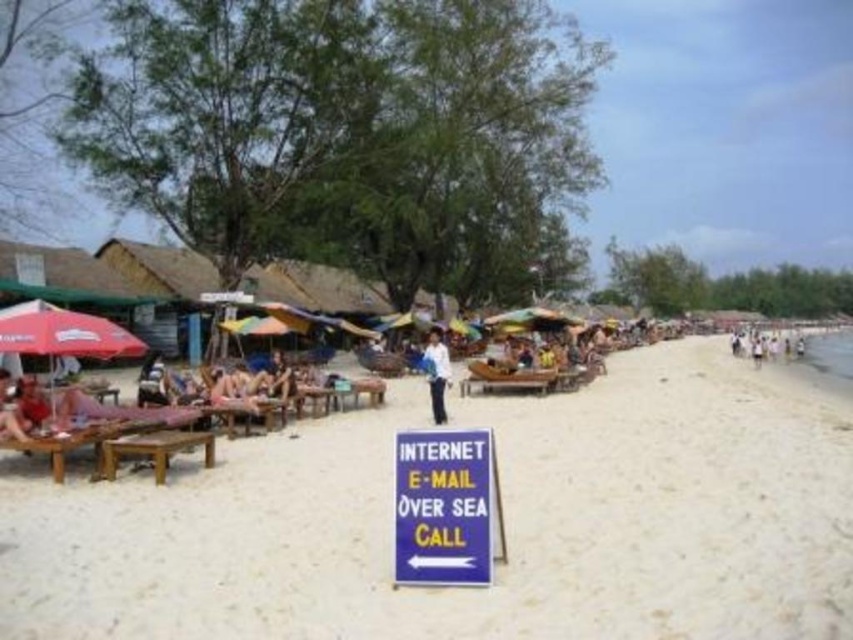
Between white sand at center and red fabric umbrella at left, which one has more height?

With more height is white sand at center.

Who is more distant from viewer, (650, 538) or (32, 300)?

Point (32, 300)

Which is in front, point (770, 588) or point (50, 323)?

Point (770, 588) is in front.

You are a GUI agent. You are given a task and a screenshot of the screen. Output one action in this format:
    pyautogui.click(x=<x>, y=<y>)
    Task: Click on the white sand at center
    The image size is (853, 640).
    Given the screenshot: What is the action you would take?
    pyautogui.click(x=503, y=520)

Is blue plastic sign at center in front of white fabric shirt at center?

Yes, blue plastic sign at center is closer to the viewer.

Does blue plastic sign at center have a lesser width compared to white fabric shirt at center?

No.

Find the location of a particular element. Image resolution: width=853 pixels, height=640 pixels. blue plastic sign at center is located at coordinates (445, 508).

Does white fabric shirt at center have a larger size compared to reddish-brown wooden bench at lower left?

Yes, white fabric shirt at center is bigger than reddish-brown wooden bench at lower left.

Which of these two, white fabric shirt at center or reddish-brown wooden bench at lower left, stands shorter?

reddish-brown wooden bench at lower left

Identify the location of white fabric shirt at center. (436, 372).